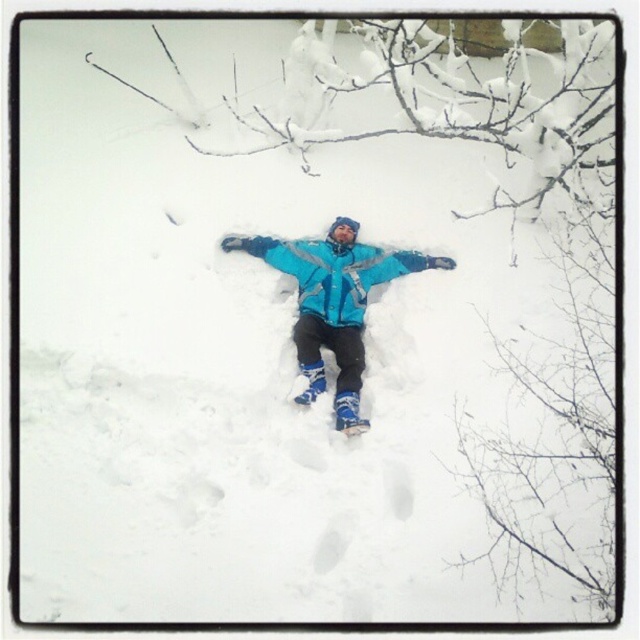
You are a photographer trying to capture the snow angel scene. You have a camera with a 2.5 inch wide lens. Can you fit both the blue matte jacket at center and the blue fleece jacket at center into the frame without moving the camera?

The distance between the blue matte jacket at center and the blue fleece jacket at center is 2.40 inches. Since your lens is 2.5 inches wide, which is slightly wider than the distance between them, you can fit both into the frame without moving the camera.

You are a fashion designer observing the winter scene. You notice two jackets at the center of the image. Which one is taller, the blue matte jacket at center or the blue fleece jacket at center?

The blue matte jacket at center is taller than the blue fleece jacket at center.